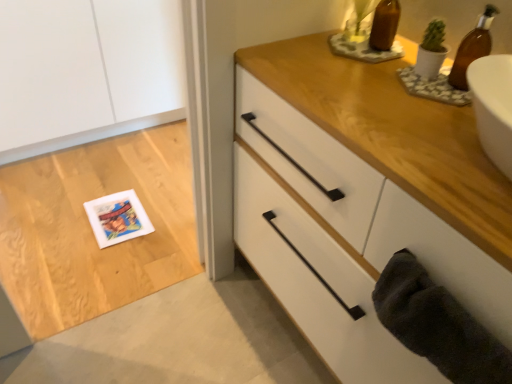
Question: Is white matte postcard at lower left smaller than white matte chest of drawers at upper right?

Choices:
 (A) yes
 (B) no

Answer: (A)

Question: From the image's perspective, is white matte postcard at lower left on white matte chest of drawers at upper right?

Choices:
 (A) no
 (B) yes

Answer: (A)

Question: Is white matte postcard at lower left facing towards white matte chest of drawers at upper right?

Choices:
 (A) yes
 (B) no

Answer: (B)

Question: Can you confirm if white matte postcard at lower left is taller than white matte chest of drawers at upper right?

Choices:
 (A) yes
 (B) no

Answer: (B)

Question: From a real-world perspective, does white matte postcard at lower left sit lower than white matte chest of drawers at upper right?

Choices:
 (A) no
 (B) yes

Answer: (B)

Question: From a real-world perspective, is dark gray plush bath towel at lower right above or below white matte postcard at lower left?

Choices:
 (A) above
 (B) below

Answer: (A)

Question: From the image's perspective, relative to white matte postcard at lower left, is dark gray plush bath towel at lower right above or below?

Choices:
 (A) below
 (B) above

Answer: (A)

Question: Would you say dark gray plush bath towel at lower right is to the left or to the right of white matte postcard at lower left in the picture?

Choices:
 (A) right
 (B) left

Answer: (A)

Question: Considering the positions of point (399, 296) and point (142, 228), is point (399, 296) closer or farther from the camera than point (142, 228)?

Choices:
 (A) closer
 (B) farther

Answer: (A)

Question: From the image's perspective, is white matte postcard at lower left located above or below white matte chest of drawers at upper right?

Choices:
 (A) above
 (B) below

Answer: (B)

Question: From their relative heights in the image, would you say white matte postcard at lower left is taller or shorter than white matte chest of drawers at upper right?

Choices:
 (A) tall
 (B) short

Answer: (B)

Question: Is white matte postcard at lower left situated inside white matte chest of drawers at upper right or outside?

Choices:
 (A) outside
 (B) inside

Answer: (A)

Question: From a real-world perspective, relative to white matte chest of drawers at upper right, is white matte postcard at lower left vertically above or below?

Choices:
 (A) above
 (B) below

Answer: (B)

Question: Would you say brown glass bottle at upper right is to the left or to the right of white matte chest of drawers at upper right in the picture?

Choices:
 (A) left
 (B) right

Answer: (B)

Question: Is brown glass bottle at upper right situated inside white matte chest of drawers at upper right or outside?

Choices:
 (A) inside
 (B) outside

Answer: (B)